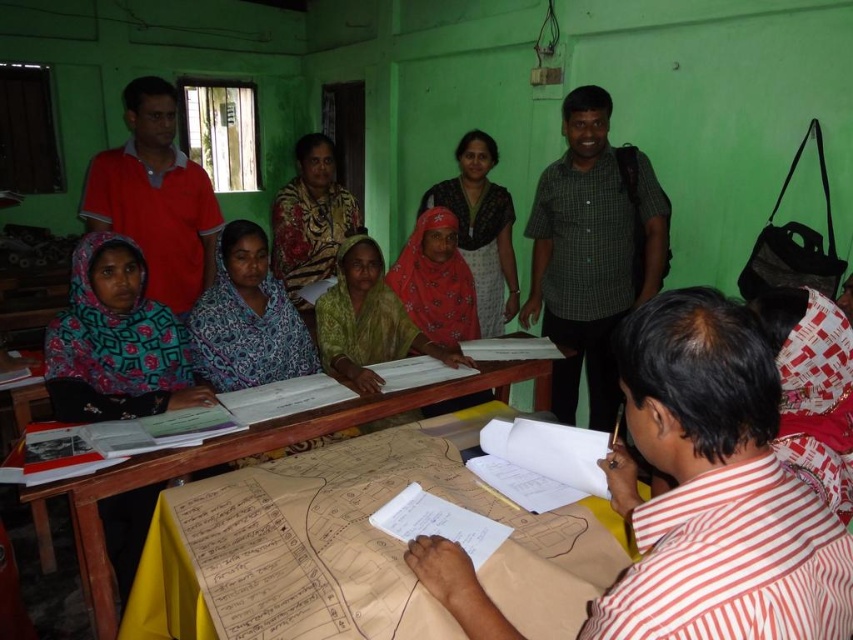
Can you confirm if striped cotton shirt at center is positioned to the right of green checkered shirt at upper right?

Incorrect, striped cotton shirt at center is not on the right side of green checkered shirt at upper right.

Does striped cotton shirt at center have a larger size compared to green checkered shirt at upper right?

No, striped cotton shirt at center is not bigger than green checkered shirt at upper right.

The width and height of the screenshot is (853, 640). I want to click on striped cotton shirt at center, so click(715, 490).

Does point (432, 541) lie behind point (341, 422)?

No.

Who is more forward, (821,589) or (490,372)?

Point (821,589)

Between point (692, 460) and point (405, 392), which one is positioned behind?

The point (405, 392) is more distant.

Locate an element on the screen. The height and width of the screenshot is (640, 853). striped cotton shirt at center is located at coordinates (715, 490).

Looking at this image, which is above, red cotton shirt at upper left or yellow fabric-covered table at center?

red cotton shirt at upper left is above.

What do you see at coordinates (155, 196) in the screenshot? I see `red cotton shirt at upper left` at bounding box center [155, 196].

This screenshot has height=640, width=853. I want to click on red cotton shirt at upper left, so click(x=155, y=196).